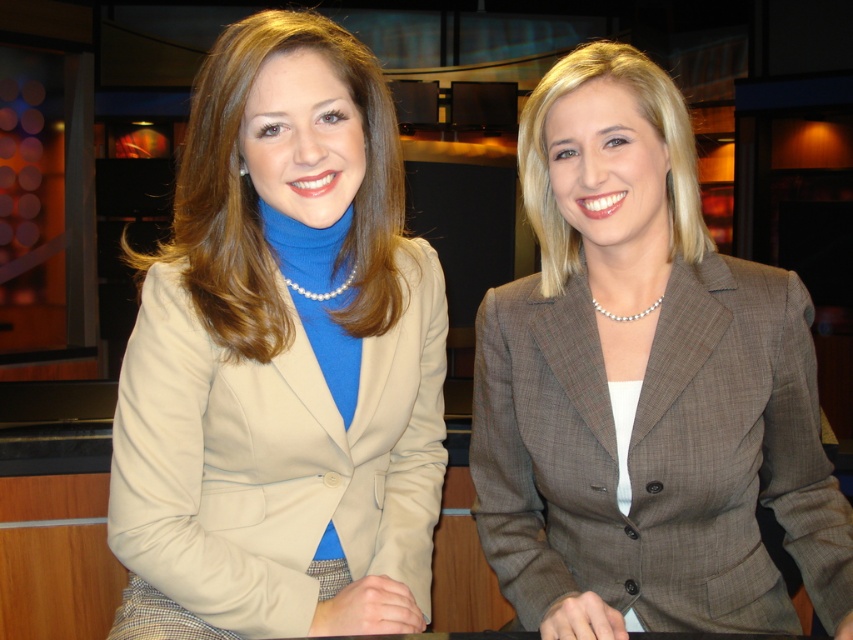
You are a photographer setting up for a professional photoshoot in a studio. You need to ensure that the matte beige blazer at center and the gray plaid blazer at center are positioned correctly according to the scene. Which blazer should be placed to the left to match the original image?

The matte beige blazer at center should be placed to the left of the gray plaid blazer at center to match the original image.

You are a tailor measuring blazers for alterations. You have two blazers on a mannequin in front of you. The matte beige blazer at center and the gray plaid blazer at center. Which blazer has a narrower width?

The matte beige blazer at center has a lesser width compared to the gray plaid blazer at center, so the matte beige blazer at center is narrower.